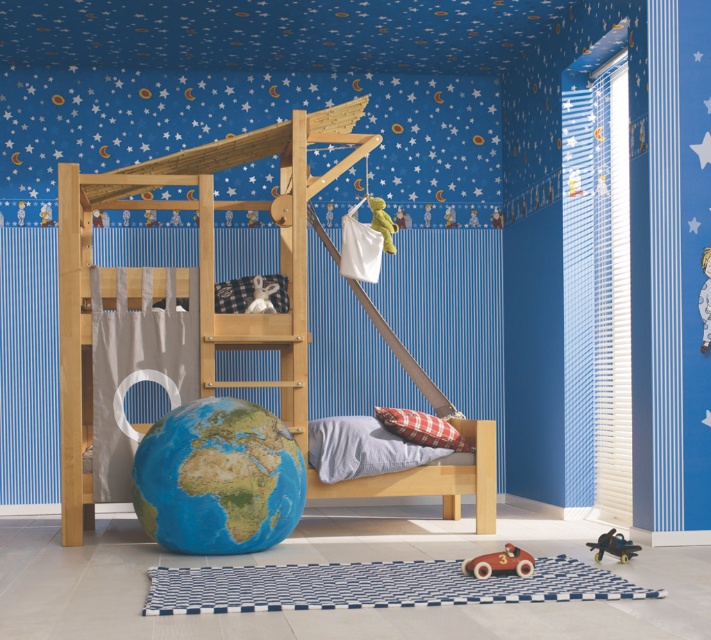
Question: Which point is farther from the camera taking this photo?

Choices:
 (A) (464, 486)
 (B) (257, 278)
 (C) (161, 426)
 (D) (631, 554)

Answer: (B)

Question: Does earth globe at center have a larger size compared to metallic black airplane at lower right?

Choices:
 (A) no
 (B) yes

Answer: (B)

Question: Observing the image, what is the correct spatial positioning of wooden toy car at lower center in reference to metallic black airplane at lower right?

Choices:
 (A) left
 (B) right

Answer: (A)

Question: Can you confirm if metallic black airplane at lower right is positioned to the right of white fabric stuffed animal at center?

Choices:
 (A) no
 (B) yes

Answer: (B)

Question: Which point is farther to the camera?

Choices:
 (A) (385, 225)
 (B) (510, 545)
 (C) (230, 518)
 (D) (250, 301)

Answer: (D)

Question: Which point is closer to the camera taking this photo?

Choices:
 (A) pyautogui.click(x=164, y=204)
 (B) pyautogui.click(x=257, y=307)
 (C) pyautogui.click(x=279, y=502)
 (D) pyautogui.click(x=602, y=532)

Answer: (C)